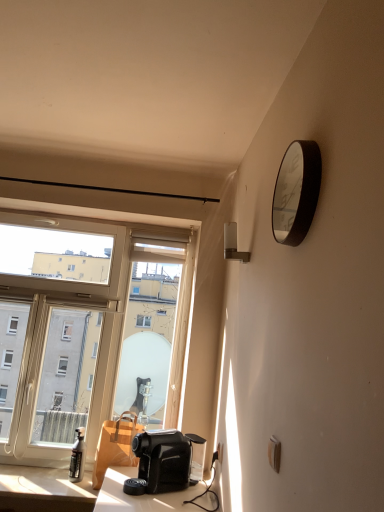
You are a GUI agent. You are given a task and a screenshot of the screen. Output one action in this format:
    pyautogui.click(x=<x>, y=<y>)
    Task: Click on the vacant space that is to the left of matte black spray bottle at lower left
    The width and height of the screenshot is (384, 512).
    Given the screenshot: What is the action you would take?
    pyautogui.click(x=48, y=476)